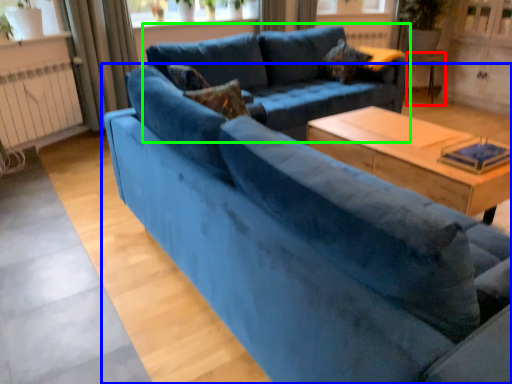
Question: Considering the real-world distances, which object is farthest from side table (highlighted by a red box)? studio couch (highlighted by a blue box) or studio couch (highlighted by a green box)?

Choices:
 (A) studio couch
 (B) studio couch

Answer: (A)